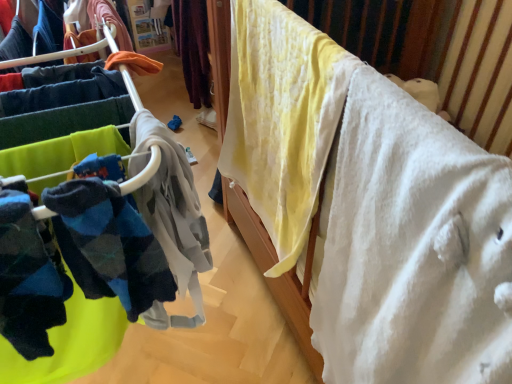
Question: Considering the relative sizes of soft fleece socks at left and white soft blanket at upper right in the image provided, is soft fleece socks at left smaller than white soft blanket at upper right?

Choices:
 (A) yes
 (B) no

Answer: (B)

Question: From the image's perspective, would you say soft fleece socks at left is shown under white soft blanket at upper right?

Choices:
 (A) no
 (B) yes

Answer: (A)

Question: Can we say soft fleece socks at left lies outside white soft blanket at upper right?

Choices:
 (A) yes
 (B) no

Answer: (A)

Question: Does soft fleece socks at left come in front of white soft blanket at upper right?

Choices:
 (A) yes
 (B) no

Answer: (A)

Question: Considering the relative sizes of soft fleece socks at left and white soft blanket at upper right in the image provided, is soft fleece socks at left shorter than white soft blanket at upper right?

Choices:
 (A) no
 (B) yes

Answer: (A)

Question: From their relative heights in the image, would you say white soft blanket at upper right is taller or shorter than yellow cotton blanket at upper right?

Choices:
 (A) short
 (B) tall

Answer: (A)

Question: Based on their sizes in the image, would you say white soft blanket at upper right is bigger or smaller than yellow cotton blanket at upper right?

Choices:
 (A) small
 (B) big

Answer: (B)

Question: From the image's perspective, is white soft blanket at upper right above or below yellow cotton blanket at upper right?

Choices:
 (A) below
 (B) above

Answer: (A)

Question: From a real-world perspective, is white soft blanket at upper right above or below yellow cotton blanket at upper right?

Choices:
 (A) above
 (B) below

Answer: (A)

Question: Does point (280, 246) appear closer or farther from the camera than point (110, 301)?

Choices:
 (A) closer
 (B) farther

Answer: (B)

Question: In terms of height, does yellow cotton blanket at upper right look taller or shorter compared to soft fleece socks at left?

Choices:
 (A) tall
 (B) short

Answer: (B)

Question: From the image's perspective, is yellow cotton blanket at upper right located above or below soft fleece socks at left?

Choices:
 (A) below
 (B) above

Answer: (A)

Question: Is yellow cotton blanket at upper right spatially inside soft fleece socks at left, or outside of it?

Choices:
 (A) outside
 (B) inside

Answer: (A)

Question: Is point (352, 292) positioned closer to the camera than point (58, 167)?

Choices:
 (A) closer
 (B) farther

Answer: (B)

Question: Looking at their shapes, would you say white soft blanket at upper right is wider or thinner than soft fleece socks at left?

Choices:
 (A) thin
 (B) wide

Answer: (A)